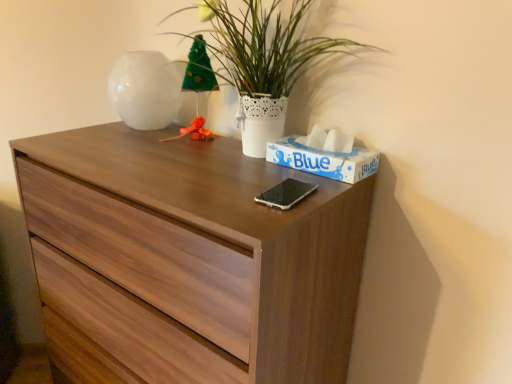
At what (x,y) coordinates should I click in order to perform the action: click on free space that is to the left of green leafy plant at upper center. Please return your answer as a coordinate pair (x, y). Image resolution: width=512 pixels, height=384 pixels. Looking at the image, I should click on (128, 151).